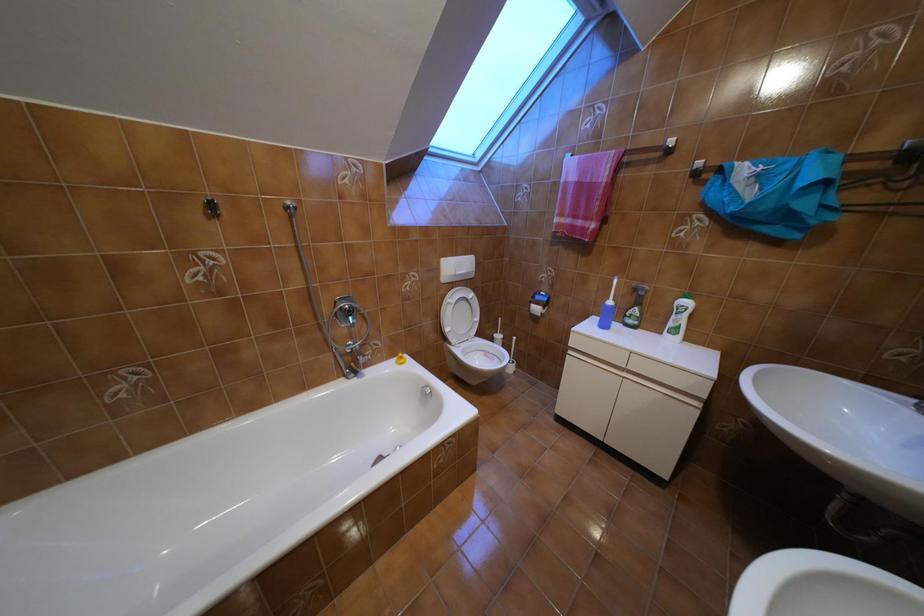
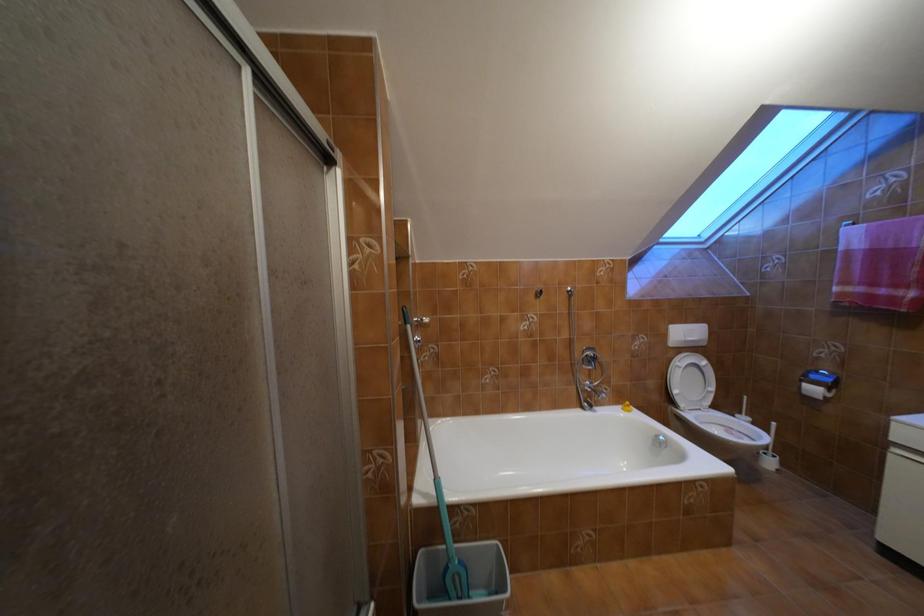
Question: The images are taken continuously from a first-person perspective. In which direction is your viewpoint rotating?

Choices:
 (A) Left
 (B) Right
 (C) Up
 (D) Down

Answer: (A)